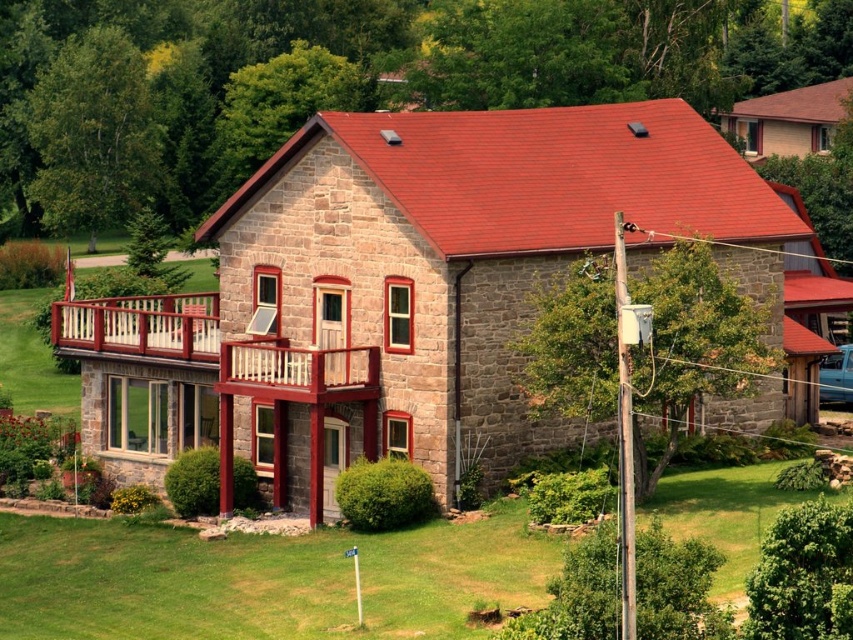
Is wooden railing at upper left positioned behind wooden railing balcony at center?

Yes, wooden railing at upper left is further from the viewer.

Is point (57, 310) positioned behind point (344, 358)?

Yes, point (57, 310) is behind point (344, 358).

Is point (61, 317) less distant than point (233, 384)?

No.

Where is `wooden railing at upper left`? This screenshot has height=640, width=853. wooden railing at upper left is located at coordinates (140, 324).